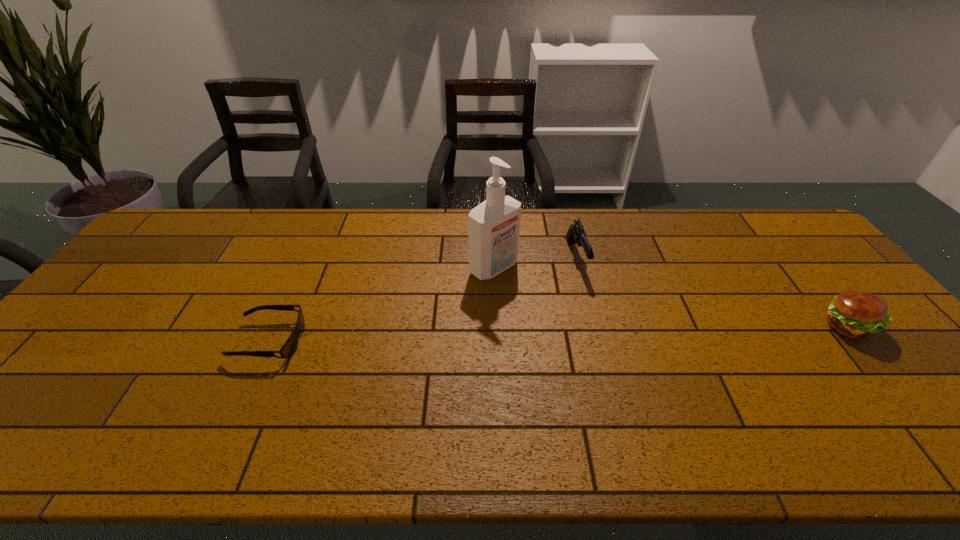
Where is `free space between the gun and the hamburger`? free space between the gun and the hamburger is located at coordinates (712, 292).

Locate an element on the screen. unoccupied position between the shortest object and the tallest object is located at coordinates (381, 304).

You are a GUI agent. You are given a task and a screenshot of the screen. Output one action in this format:
    pyautogui.click(x=<x>, y=<y>)
    Task: Click on the empty location between the farthest object and the sunglasses
    
    Given the screenshot: What is the action you would take?
    382,278

Find the location of a particular element. The width and height of the screenshot is (960, 540). vacant area that lies between the rightmost object and the sunglasses is located at coordinates (559, 333).

The width and height of the screenshot is (960, 540). Find the location of `vacant area that lies between the second object from right to left and the tallest object`. vacant area that lies between the second object from right to left and the tallest object is located at coordinates (535, 263).

Locate an element on the screen. free space that is in between the second object from right to left and the cleansing agent is located at coordinates (535, 263).

At what (x,y) coordinates should I click in order to perform the action: click on free space that is in between the hamburger and the tallest object. Please return your answer as a coordinate pair (x, y). Looking at the image, I should click on (670, 298).

At what (x,y) coordinates should I click in order to perform the action: click on the third closest object relative to the cleansing agent. Please return your answer as a coordinate pair (x, y). The height and width of the screenshot is (540, 960). Looking at the image, I should click on (289, 348).

Where is `object that is the closest to the hamburger`? object that is the closest to the hamburger is located at coordinates (576, 234).

You are a GUI agent. You are given a task and a screenshot of the screen. Output one action in this format:
    pyautogui.click(x=<x>, y=<y>)
    Task: Click on the free region that satisfies the following two spatial constraints: 1. on the front side of the rightmost object; 2. on the left side of the Lego
    
    Given the screenshot: What is the action you would take?
    pyautogui.click(x=499, y=327)